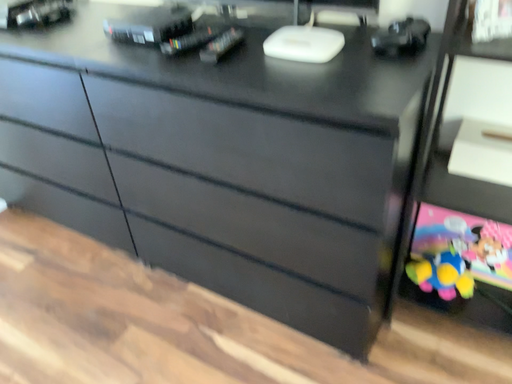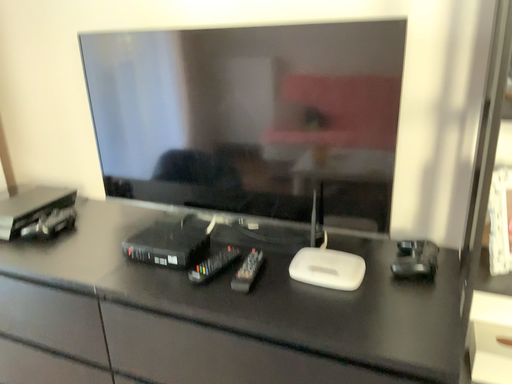
Question: How did the camera likely rotate when shooting the video?

Choices:
 (A) rotated downward
 (B) rotated upward

Answer: (B)